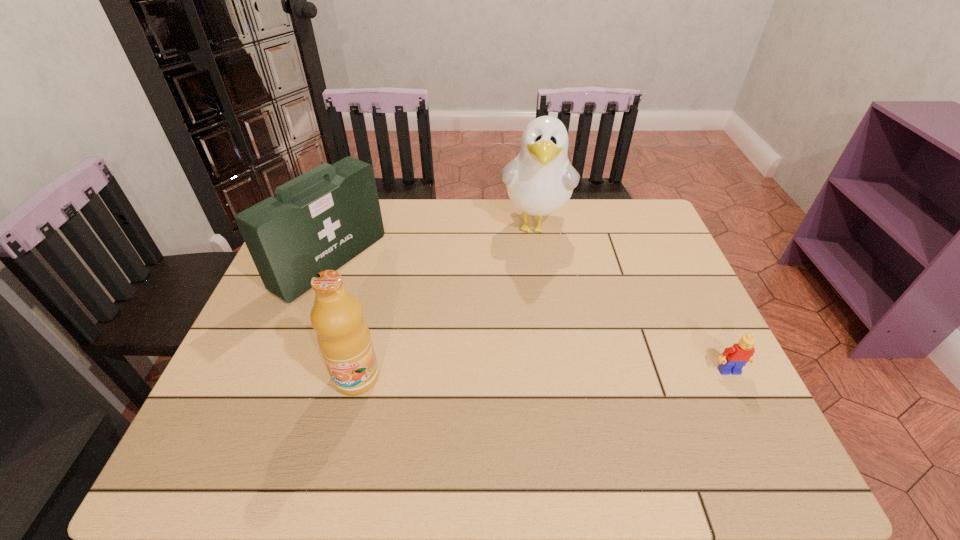
Where is `fruit juice`? The width and height of the screenshot is (960, 540). fruit juice is located at coordinates (343, 336).

Identify the location of the shortest object. (733, 359).

I want to click on Lego, so click(x=733, y=359).

Where is `the tallest object`? The height and width of the screenshot is (540, 960). the tallest object is located at coordinates (540, 180).

At what (x,y) coordinates should I click in order to perform the action: click on the second object from right to left. Please return your answer as a coordinate pair (x, y). This screenshot has width=960, height=540. Looking at the image, I should click on (540, 180).

What are the coordinates of `the first-aid kit` in the screenshot? It's located at (322, 219).

Locate an element on the screen. The image size is (960, 540). free space located 0.110m on the face of the Lego is located at coordinates (754, 421).

This screenshot has height=540, width=960. In order to click on blank space located on the beak of the tallest object in this screenshot , I will do `click(524, 320)`.

Where is `vacant space situated 0.220m on the beak of the tallest object`? The width and height of the screenshot is (960, 540). vacant space situated 0.220m on the beak of the tallest object is located at coordinates (525, 308).

Locate an element on the screen. blank area located 0.250m on the beak of the tallest object is located at coordinates (524, 317).